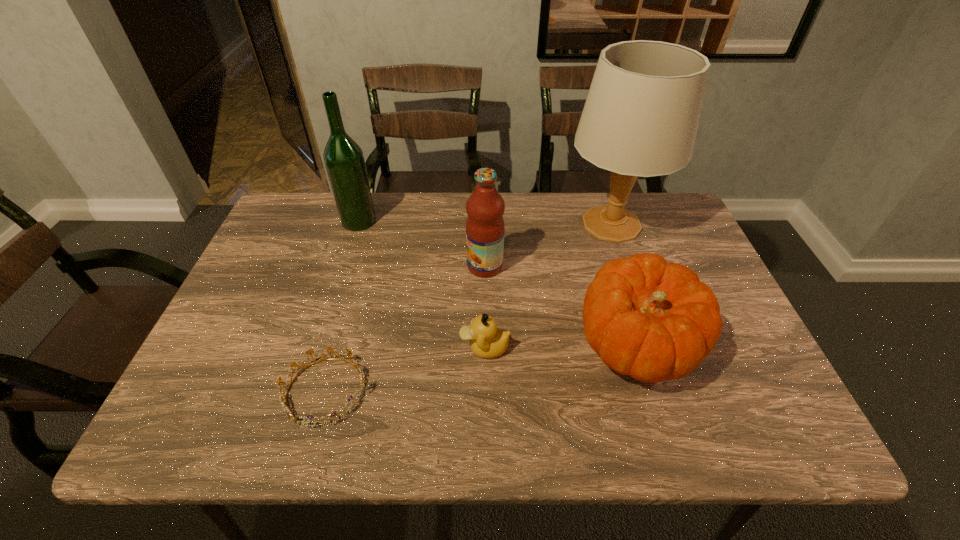
What are the coordinates of `pumpkin at the right edge` in the screenshot? It's located at (652, 320).

The image size is (960, 540). What are the coordinates of `object that is at the far right corner` in the screenshot? It's located at (641, 115).

In order to click on free space at the far edge of the desktop in this screenshot , I will do `click(429, 204)`.

This screenshot has width=960, height=540. Identify the location of blank space at the near edge of the desktop. (672, 439).

The width and height of the screenshot is (960, 540). In the image, there is a desktop. Identify the location of vacant area at the left edge. pyautogui.click(x=266, y=334).

Locate an element on the screen. The height and width of the screenshot is (540, 960). vacant space at the far left corner of the desktop is located at coordinates (311, 219).

Find the location of `vacant region at the far right corner of the desktop`. vacant region at the far right corner of the desktop is located at coordinates (666, 231).

This screenshot has width=960, height=540. I want to click on vacant point located between the second shortest object and the alcohol, so click(x=421, y=284).

The image size is (960, 540). Find the location of `vacant area that lies between the fruit juice and the tallest object`. vacant area that lies between the fruit juice and the tallest object is located at coordinates (548, 245).

I want to click on free space between the duckling and the third shortest object, so click(x=561, y=346).